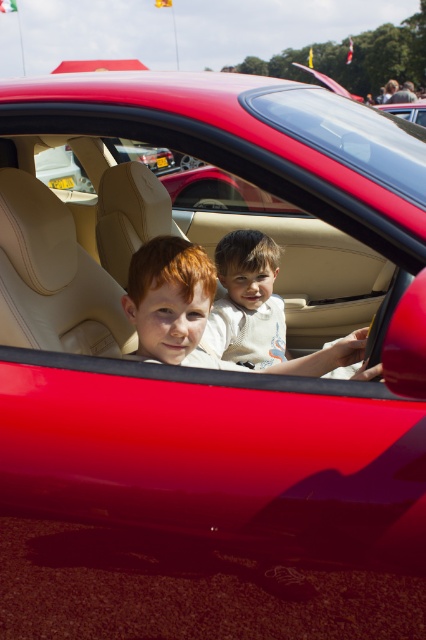
You are a photographer trying to capture a clear shot of both the light beige leather child at center and the glossy red car at upper center. Since you can only focus on one subject at a time, which one should you choose to ensure the other remains in the background?

You should focus on the light beige leather child at center because it is positioned on the left side of the glossy red car at upper center, meaning the car will still be visible in the background.

You are a photographer who wants to capture a clear photo of both the light beige leather child at center and the glossy red car at upper center. Since the camera can only focus on one subject at a time, which subject should you choose to ensure the smaller one is in focus?

→ The light beige leather child at center is smaller than the glossy red car at upper center, so you should focus on the light beige leather child at center to ensure it is in focus.

You are a photographer standing 2 meters away from the camera. You want to take a photo of the light beige leather child at center. Is the child within your camera range?

The light beige leather child at center is 2.07 meters from the camera, which is slightly beyond the photographer standing 2 meters away. Therefore, the child is just out of range.